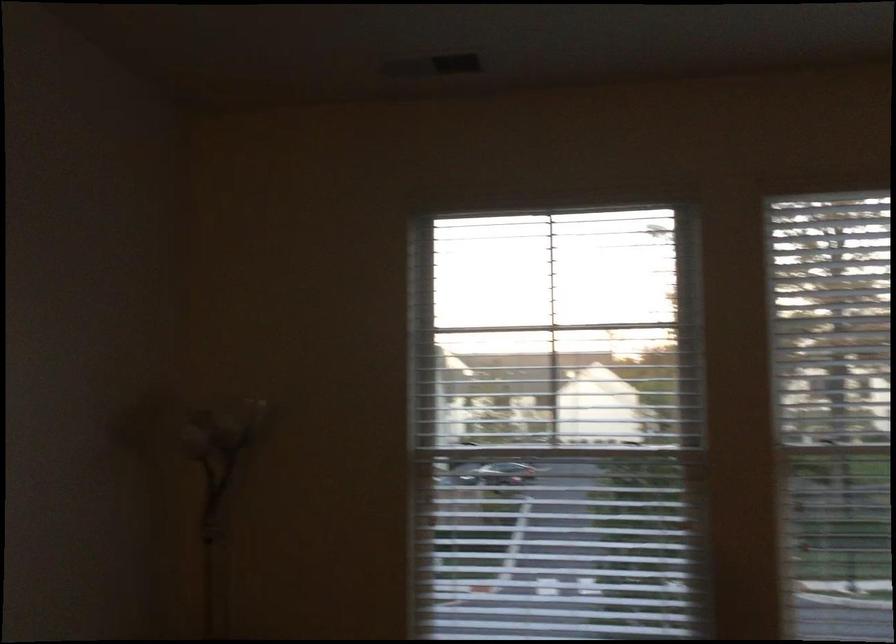
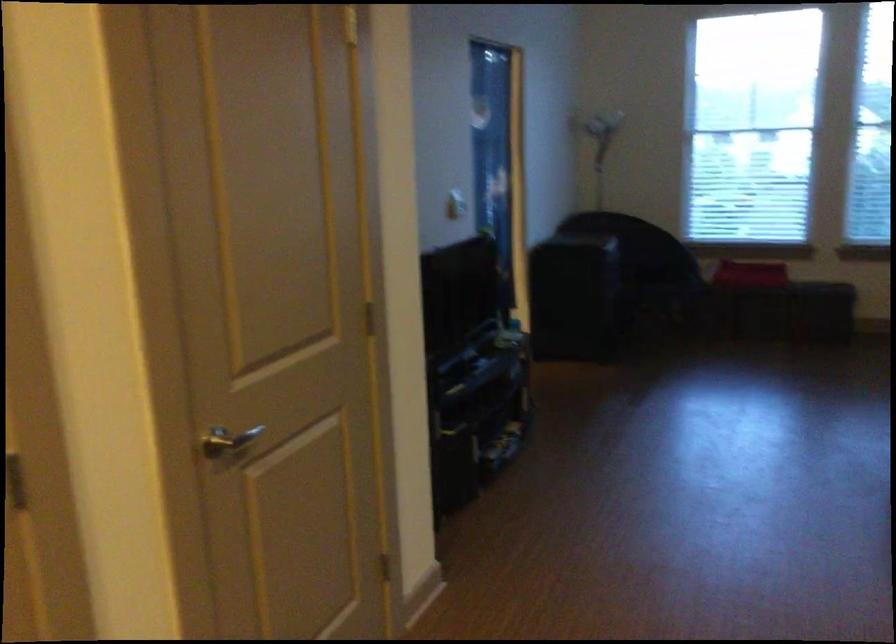
Question: In a continuous first-person perspective shot, in which direction is the camera moving?

Choices:
 (A) Left
 (B) Right
 (C) Forward
 (D) Backward

Answer: (D)